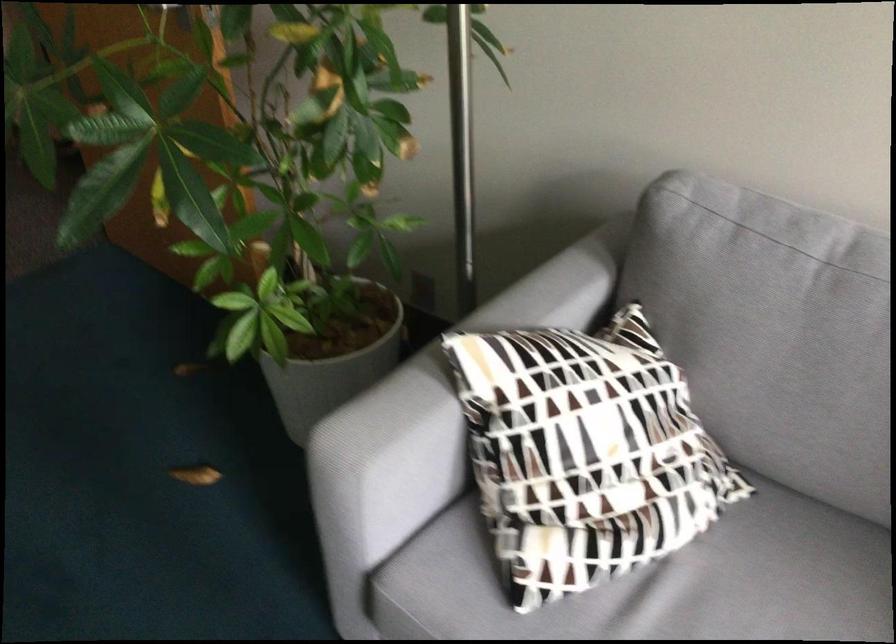
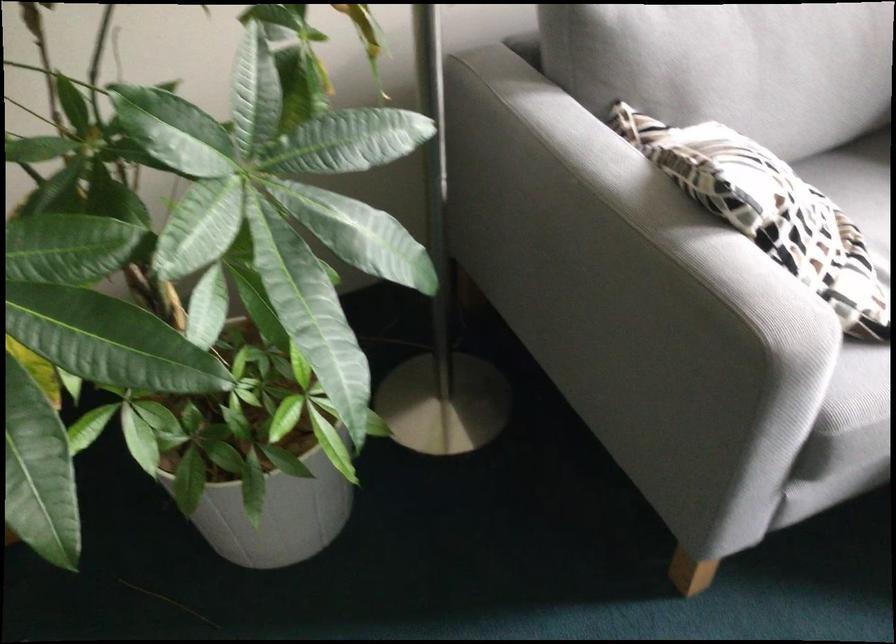
The point at (271, 375) is marked in the first image. Where is the corresponding point in the second image?

(273, 506)